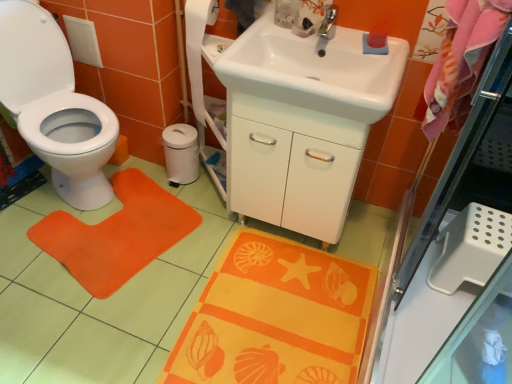
You are a GUI agent. You are given a task and a screenshot of the screen. Output one action in this format:
    pyautogui.click(x=<x>, y=<y>)
    Task: Click on the vacant region above orange fabric bath mat at lower center (from a real-world perspective)
    Image resolution: width=512 pixels, height=384 pixels.
    Given the screenshot: What is the action you would take?
    pyautogui.click(x=271, y=307)